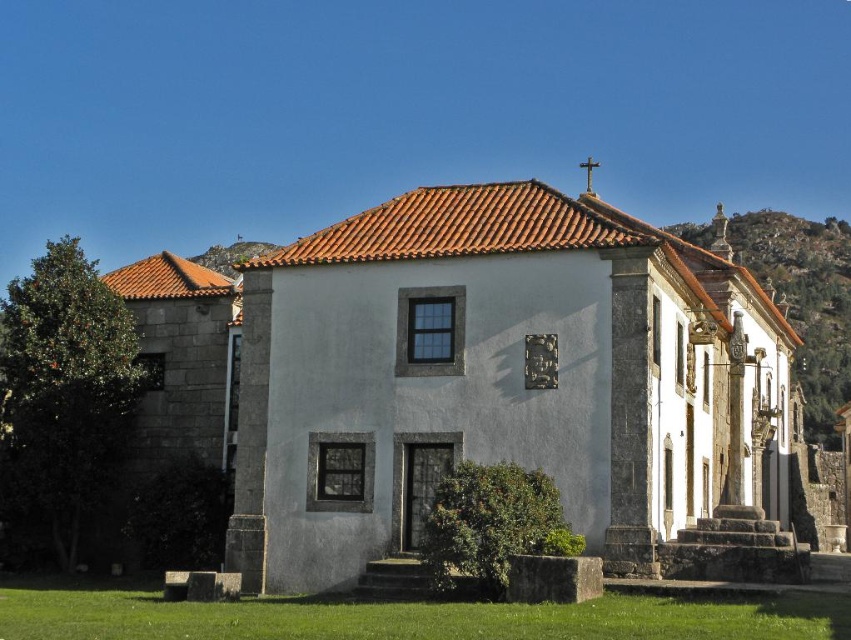
Is white stone chapel at center taller than rustic stone hillside at upper right?

No.

Does white stone chapel at center appear over rustic stone hillside at upper right?

No.

Which is in front, point (328, 321) or point (847, 365)?

Point (328, 321)

At what (x,y) coordinates should I click in order to perform the action: click on white stone chapel at center. Please return your answer as a coordinate pair (x, y). This screenshot has height=640, width=851. Looking at the image, I should click on (495, 378).